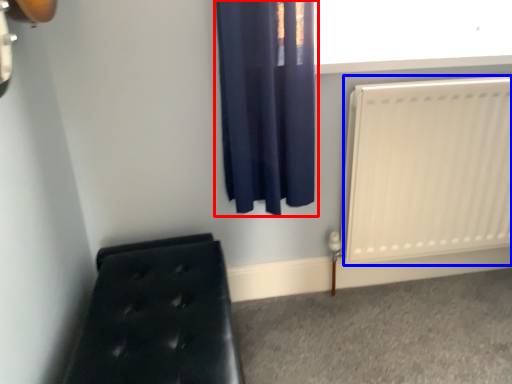
Question: Which object appears closest to the camera in this image, curtain (highlighted by a red box) or radiator (highlighted by a blue box)?

Choices:
 (A) curtain
 (B) radiator

Answer: (A)